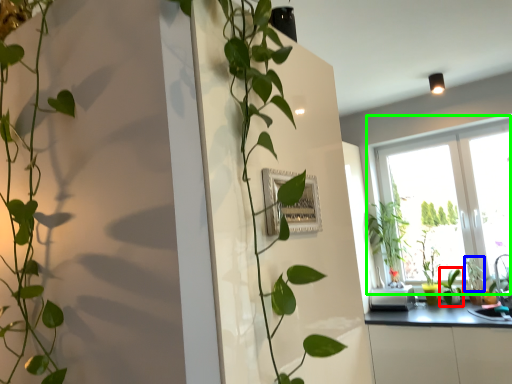
Question: Estimate the real-world distances between objects in this image. Which object is closer to plant (highlighted by a red box), plant (highlighted by a blue box) or window (highlighted by a green box)?

Choices:
 (A) plant
 (B) window

Answer: (A)